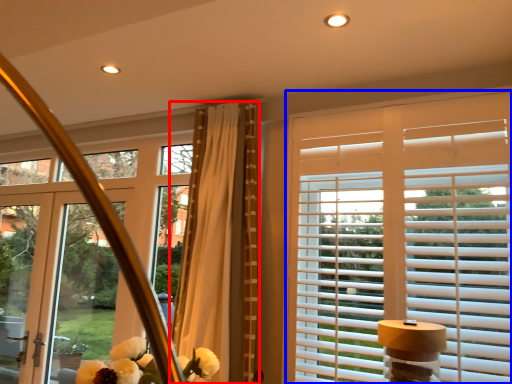
Question: Which object appears farthest to the camera in this image, curtain (highlighted by a red box) or window blind (highlighted by a blue box)?

Choices:
 (A) curtain
 (B) window blind

Answer: (A)